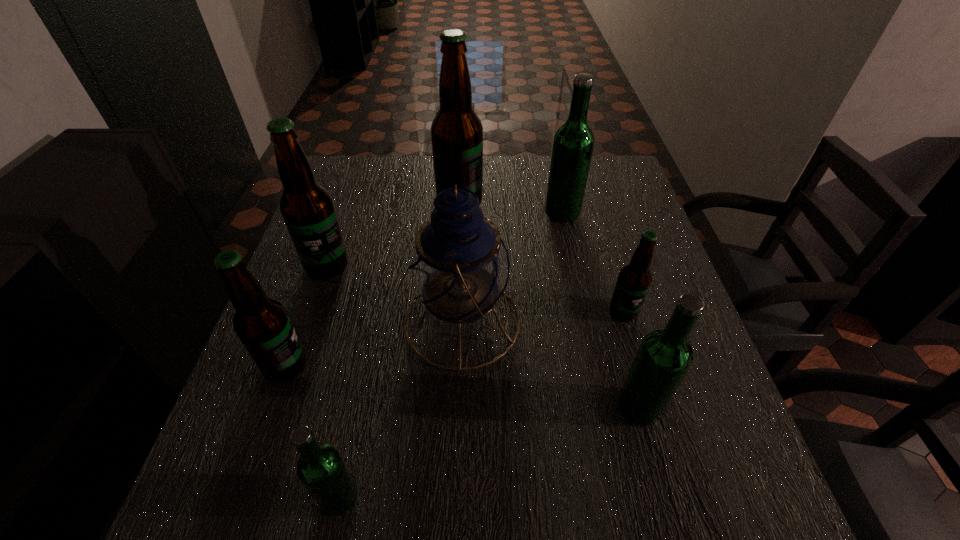
Identify the location of the fourth farthest beer bottle. The image size is (960, 540). (634, 279).

Locate an element on the screen. the smallest brown beer bottle is located at coordinates (634, 279).

Identify the location of the nearest green beer bottle. (321, 469).

The image size is (960, 540). I want to click on the leftmost green beer bottle, so click(321, 469).

The image size is (960, 540). In order to click on blank area located on the label of the farthest brown beer bottle in this screenshot , I will do click(566, 202).

The height and width of the screenshot is (540, 960). I want to click on free space located on the left of the biggest green beer bottle, so click(x=472, y=212).

The image size is (960, 540). What are the coordinates of `vacant space located on the label of the fifth nearest beer bottle` in the screenshot? It's located at (265, 448).

Identify the location of free region located on the front-facing side of the lantern. (616, 321).

You are a GUI agent. You are given a task and a screenshot of the screen. Output one action in this format:
    pyautogui.click(x=<x>, y=<y>)
    Task: Click on the vacant space located on the label of the second smallest brown beer bottle
    The height and width of the screenshot is (540, 960).
    Given the screenshot: What is the action you would take?
    pyautogui.click(x=507, y=366)

You are a GUI agent. You are given a task and a screenshot of the screen. Output one action in this format:
    pyautogui.click(x=<x>, y=<y>)
    Task: Click on the free space located on the front of the second nearest beer bottle
    This screenshot has height=540, width=960.
    Given the screenshot: What is the action you would take?
    pyautogui.click(x=654, y=461)